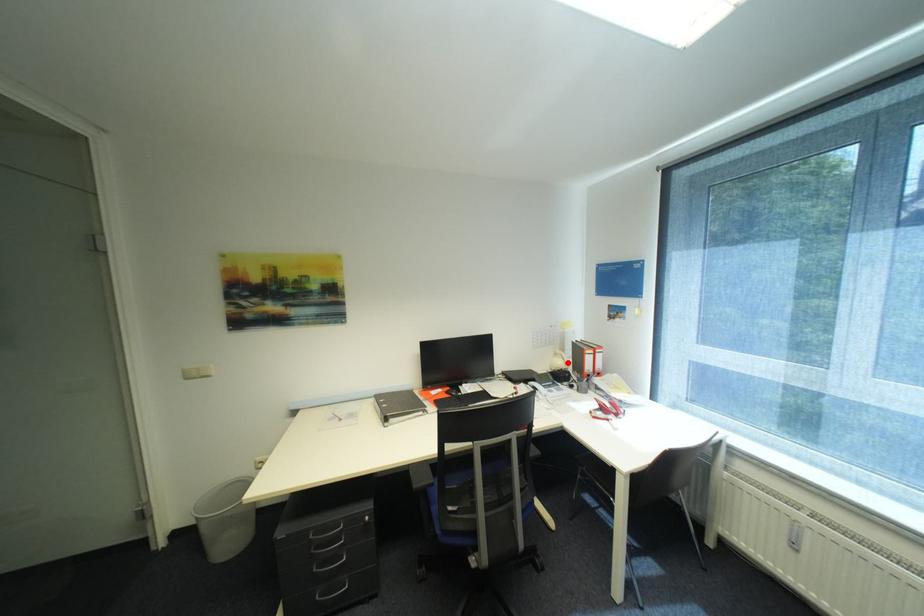
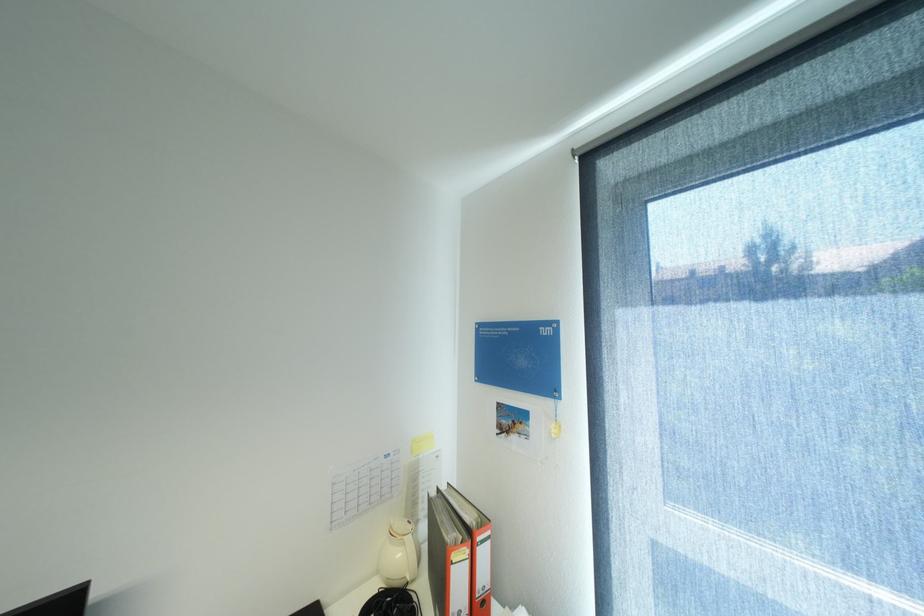
In the second image, find the point that corresponds to the highlighted location in the first image.

(407, 554)